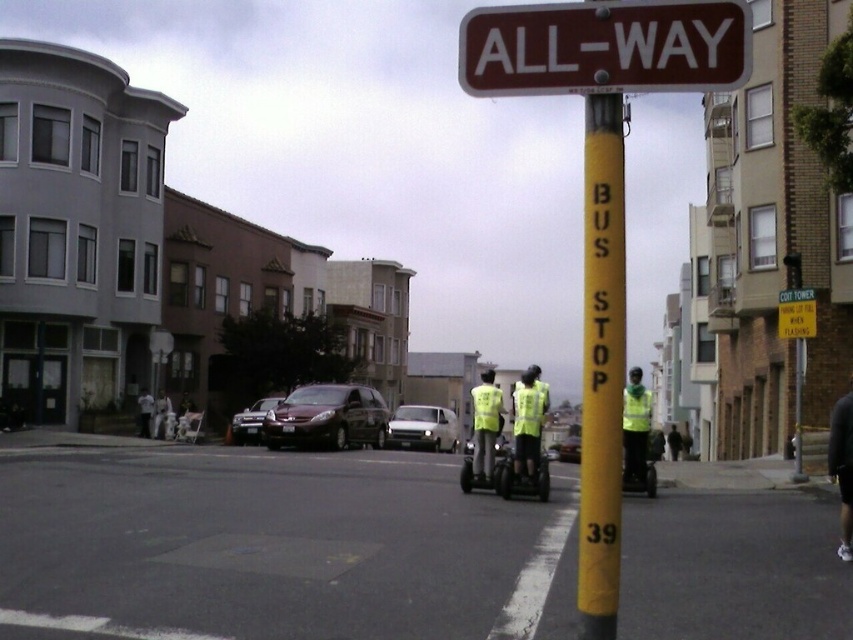
Question: Can you confirm if yellow reflective vest at center is bigger than metallic silver sedan at center?

Choices:
 (A) no
 (B) yes

Answer: (A)

Question: Considering the relative positions of high-visibility yellow vest at center and shiny black sedan at center-left in the image provided, where is high-visibility yellow vest at center located with respect to shiny black sedan at center-left?

Choices:
 (A) left
 (B) right

Answer: (B)

Question: Which of the following is the closest to the observer?

Choices:
 (A) white matte car at center
 (B) high-visibility reflective vest at center
 (C) reflective yellow safety vest at center

Answer: (C)

Question: Which of the following is the farthest from the observer?

Choices:
 (A) high-visibility yellow vest at center
 (B) shiny dark red car at center
 (C) shiny black sedan at center-left

Answer: (C)

Question: Where is dark gray pants at lower right located in relation to white fabric shirt at center in the image?

Choices:
 (A) above
 (B) below

Answer: (A)

Question: Which of the following is the closest to the observer?

Choices:
 (A) tap(260, 410)
 (B) tap(845, 476)
 (C) tap(485, 467)
 (D) tap(646, 396)

Answer: (B)